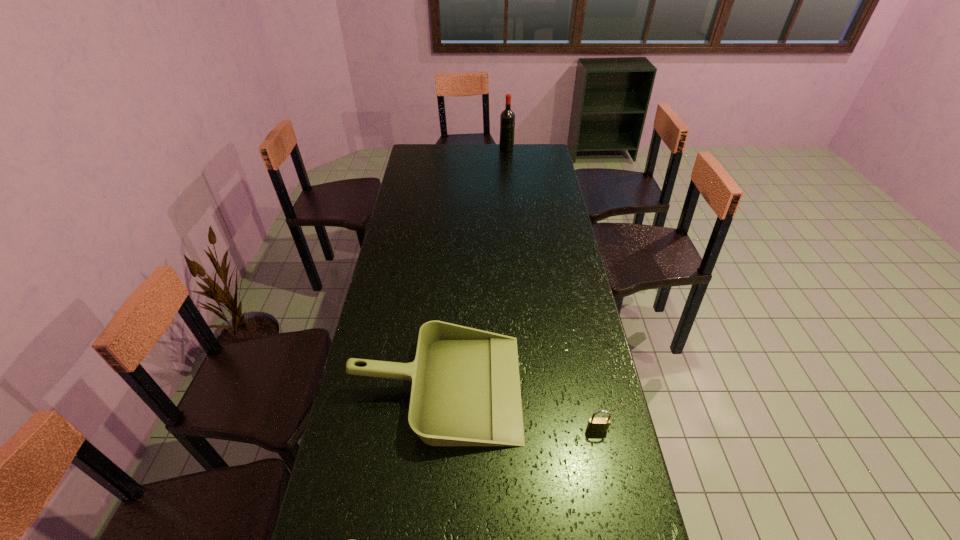
At what (x,y) coordinates should I click in order to perform the action: click on object present at the right edge. Please return your answer as a coordinate pair (x, y). Image resolution: width=960 pixels, height=540 pixels. Looking at the image, I should click on (594, 424).

In the image, there is a desktop. What are the coordinates of `free space at the far edge` in the screenshot? It's located at (474, 144).

At what (x,y) coordinates should I click in order to perform the action: click on vacant space at the left edge. Please return your answer as a coordinate pair (x, y). This screenshot has height=540, width=960. Looking at the image, I should click on (413, 260).

The image size is (960, 540). I want to click on vacant space at the right edge of the desktop, so click(573, 339).

The height and width of the screenshot is (540, 960). In order to click on free space at the far left corner of the desktop in this screenshot , I will do `click(417, 153)`.

The height and width of the screenshot is (540, 960). In order to click on free point at the far right corner in this screenshot , I will do `click(528, 153)`.

The image size is (960, 540). I want to click on free space between the farthest object and the second tallest object, so click(x=471, y=268).

This screenshot has width=960, height=540. I want to click on free space between the wine bottle and the second tallest object, so click(471, 268).

Locate an element on the screen. the closest object to the second shortest object is located at coordinates (594, 424).

Image resolution: width=960 pixels, height=540 pixels. Find the location of `object that is the second closest to the second tallest object`. object that is the second closest to the second tallest object is located at coordinates (507, 118).